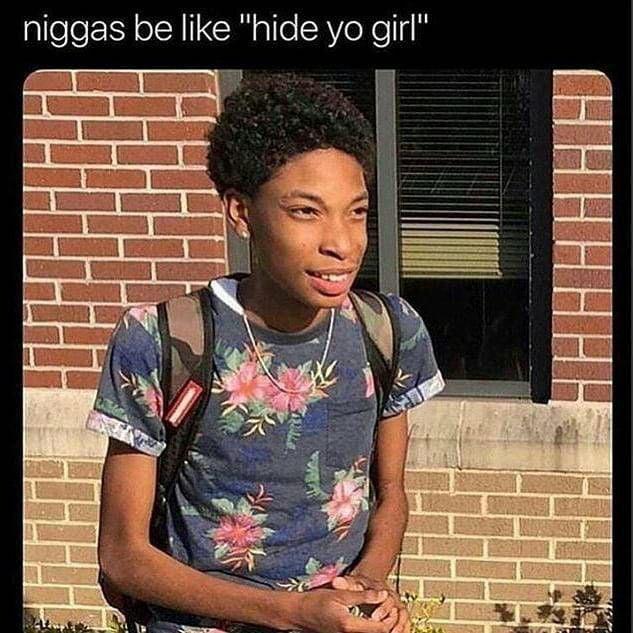
Locate an element on the screen. The image size is (633, 633). window is located at coordinates (472, 207).